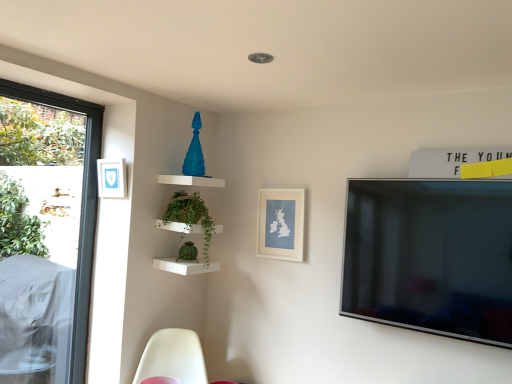
This screenshot has height=384, width=512. What do you see at coordinates (111, 178) in the screenshot? I see `blue matte picture frame at upper left, the 2th picture frame in the back-to-front sequence` at bounding box center [111, 178].

Where is `white matte picture frame at center, which ranks as the 1th picture frame in bottom-to-top order`? white matte picture frame at center, which ranks as the 1th picture frame in bottom-to-top order is located at coordinates coord(281,224).

Find the location of a particular element. white plastic swivel chair at lower left is located at coordinates (173, 357).

Image resolution: width=512 pixels, height=384 pixels. Describe the element at coordinates (173, 357) in the screenshot. I see `white plastic swivel chair at lower left` at that location.

The height and width of the screenshot is (384, 512). I want to click on transparent glass window at left, so click(81, 209).

You are a GUI agent. You are given a task and a screenshot of the screen. Output one action in this format:
    pyautogui.click(x=<x>, y=<y>)
    Task: Click on the blue matte picture frame at upper left, the first picture frame viewed from the front
    
    Given the screenshot: What is the action you would take?
    pyautogui.click(x=111, y=178)

From the image's perspective, between blue matte picture frame at upper left, the first picture frame viewed from the front, and white plastic swivel chair at lower left, who is located below?

white plastic swivel chair at lower left is shown below in the image.

Is blue matte picture frame at upper left, the 2th picture frame in the back-to-front sequence, thinner than white plastic swivel chair at lower left?

Yes, blue matte picture frame at upper left, the 2th picture frame in the back-to-front sequence, is thinner than white plastic swivel chair at lower left.

From a real-world perspective, between blue matte picture frame at upper left, the second picture frame when ordered from bottom to top, and white plastic swivel chair at lower left, who is vertically higher?

blue matte picture frame at upper left, the second picture frame when ordered from bottom to top, is physically above.

From the image's perspective, which one is positioned lower, green wicker basket at upper center or white plastic swivel chair at lower left?

white plastic swivel chair at lower left, from the image's perspective.

Is point (186, 219) farther from camera compared to point (168, 346)?

No.

Is green wicker basket at upper center at the left side of white plastic swivel chair at lower left?

No.

Considering the positions of objects white plastic swivel chair at lower left and transparent glass window at left in the image provided, who is more to the left, white plastic swivel chair at lower left or transparent glass window at left?

transparent glass window at left.

Is white plastic swivel chair at lower left closer to the viewer compared to transparent glass window at left?

Yes, white plastic swivel chair at lower left is in front of transparent glass window at left.

Is white plastic swivel chair at lower left positioned with its back to transparent glass window at left?

No.

Considering the relative sizes of blue matte picture frame at upper left, the first picture frame from the top, and green wicker basket at upper center in the image provided, is blue matte picture frame at upper left, the first picture frame from the top, shorter than green wicker basket at upper center?

Indeed, blue matte picture frame at upper left, the first picture frame from the top, has a lesser height compared to green wicker basket at upper center.

Considering the relative sizes of blue matte picture frame at upper left, which appears as the 1th picture frame when viewed from the left, and green wicker basket at upper center in the image provided, is blue matte picture frame at upper left, which appears as the 1th picture frame when viewed from the left, bigger than green wicker basket at upper center?

Incorrect, blue matte picture frame at upper left, which appears as the 1th picture frame when viewed from the left, is not larger than green wicker basket at upper center.

Which is farther from the camera, (101, 183) or (187, 206)?

Point (187, 206)

Would you say blue matte picture frame at upper left, which appears as the 1th picture frame when viewed from the left, is inside or outside green wicker basket at upper center?

blue matte picture frame at upper left, which appears as the 1th picture frame when viewed from the left, is spatially situated outside green wicker basket at upper center.

Could you tell me if green wicker basket at upper center is facing white matte picture frame at center, which ranks as the 1th picture frame in bottom-to-top order?

No, green wicker basket at upper center is not oriented towards white matte picture frame at center, which ranks as the 1th picture frame in bottom-to-top order.

Is green wicker basket at upper center further to camera compared to white matte picture frame at center, placed as the second picture frame when sorted from left to right?

No, the depth of green wicker basket at upper center is less than that of white matte picture frame at center, placed as the second picture frame when sorted from left to right.

From a real-world perspective, which object stands above the other?

In real-world perspective, white matte picture frame at center, which ranks as the 1th picture frame in bottom-to-top order, is above.

Are green wicker basket at upper center and white matte picture frame at center, which is counted as the second picture frame, starting from the front, beside each other?

They are not placed beside each other.

Which is in front, point (298, 235) or point (182, 212)?

The point (182, 212) is more forward.

Between white matte picture frame at center, placed as the second picture frame when sorted from left to right, and green wicker basket at upper center, which one has larger width?

green wicker basket at upper center.

Between white matte picture frame at center, which is counted as the second picture frame, starting from the front, and green wicker basket at upper center, which one has smaller size?

white matte picture frame at center, which is counted as the second picture frame, starting from the front, is smaller.

Does white plastic swivel chair at lower left appear on the right side of blue matte picture frame at upper left, the 2th picture frame in the back-to-front sequence?

Yes.

Which of these two, white plastic swivel chair at lower left or blue matte picture frame at upper left, the second picture frame when ordered from bottom to top, is wider?

white plastic swivel chair at lower left is wider.

From a real-world perspective, is white plastic swivel chair at lower left below blue matte picture frame at upper left, the 2th picture frame in the back-to-front sequence?

Yes, from a real-world perspective, white plastic swivel chair at lower left is under blue matte picture frame at upper left, the 2th picture frame in the back-to-front sequence.

How different are the orientations of white plastic swivel chair at lower left and blue matte picture frame at upper left, the 2th picture frame in the back-to-front sequence, in degrees?

The angle between the facing direction of white plastic swivel chair at lower left and the facing direction of blue matte picture frame at upper left, the 2th picture frame in the back-to-front sequence, is 42.8 degrees.

Identify the location of picture frame that is the 2nd one when counting upward from the white plastic swivel chair at lower left (from the image's perspective). This screenshot has height=384, width=512. (111, 178).

The height and width of the screenshot is (384, 512). I want to click on swivel chair located on the left of green wicker basket at upper center, so click(173, 357).

Considering their positions, is green wicker basket at upper center positioned closer to transparent glass window at left than white matte picture frame at center, arranged as the 2th picture frame when viewed from the top?

green wicker basket at upper center.

From the image, which object appears to be nearer to transparent glass window at left, white matte picture frame at center, the first picture frame from the right, or green wicker basket at upper center?

The object closer to transparent glass window at left is green wicker basket at upper center.

From the image, which object appears to be nearer to white matte picture frame at center, which is the first picture frame from back to front, green wicker basket at upper center or blue matte picture frame at upper left, the second picture frame when ordered from bottom to top?

green wicker basket at upper center.

Based on their spatial positions, is white matte picture frame at center, the first picture frame from the right, or transparent glass window at left closer to blue matte picture frame at upper left, which is the second picture frame in right-to-left order?

transparent glass window at left lies closer to blue matte picture frame at upper left, which is the second picture frame in right-to-left order, than the other object.

When comparing their distances from transparent glass window at left, does green wicker basket at upper center or white plastic swivel chair at lower left seem closer?

green wicker basket at upper center.

Estimate the real-world distances between objects in this image. Which object is closer to transparent glass window at left, green wicker basket at upper center or blue matte picture frame at upper left, which is the second picture frame in right-to-left order?

Among the two, blue matte picture frame at upper left, which is the second picture frame in right-to-left order, is located nearer to transparent glass window at left.

Which object lies further to the anchor point green wicker basket at upper center, transparent glass window at left or white matte picture frame at center, placed as the second picture frame when sorted from left to right?

Among the two, transparent glass window at left is located further to green wicker basket at upper center.

Which object lies further to the anchor point green wicker basket at upper center, white matte picture frame at center, which ranks as the 1th picture frame in bottom-to-top order, or transparent glass window at left?

The object further to green wicker basket at upper center is transparent glass window at left.

This screenshot has width=512, height=384. Identify the location of swivel chair between transparent glass window at left and white matte picture frame at center, arranged as the 2th picture frame when viewed from the top, from left to right. (173, 357).

Find the location of a particular element. The image size is (512, 384). picture frame between green wicker basket at upper center and white plastic swivel chair at lower left from top to bottom is located at coordinates 281,224.

Identify the location of plant situated between blue matte picture frame at upper left, the second picture frame when ordered from bottom to top, and white matte picture frame at center, placed as the second picture frame when sorted from left to right, from left to right. (191, 216).

Find the location of a particular element. plant that lies between blue matte picture frame at upper left, which appears as the 1th picture frame when viewed from the left, and white plastic swivel chair at lower left from top to bottom is located at coordinates (191, 216).